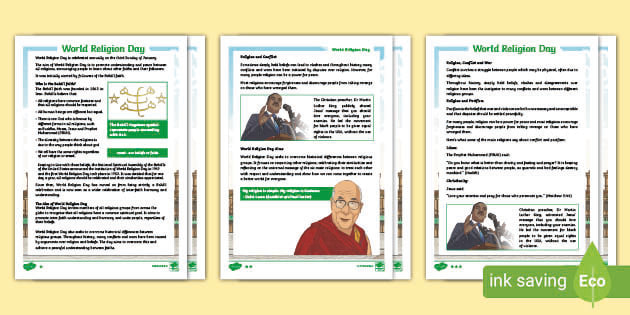
The height and width of the screenshot is (315, 630). What are the coordinates of `space above posters` in the screenshot? It's located at (140, 24), (317, 30), (516, 20).